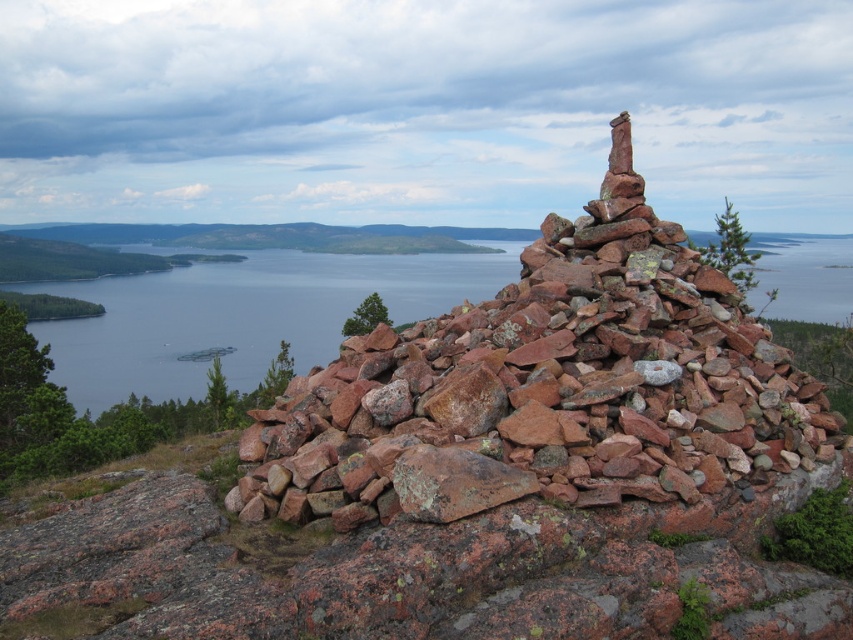
Question: Is rusty stone stack at center positioned before clear blue water at center?

Choices:
 (A) no
 (B) yes

Answer: (B)

Question: Which point is closer to the camera?

Choices:
 (A) rusty stone stack at center
 (B) clear blue water at center

Answer: (A)

Question: Can you confirm if rusty stone stack at center is positioned above clear blue water at center?

Choices:
 (A) no
 (B) yes

Answer: (A)

Question: Which point is closer to the camera taking this photo?

Choices:
 (A) (331, 273)
 (B) (561, 243)

Answer: (B)

Question: Does rusty stone stack at center have a larger size compared to clear blue water at center?

Choices:
 (A) yes
 (B) no

Answer: (B)